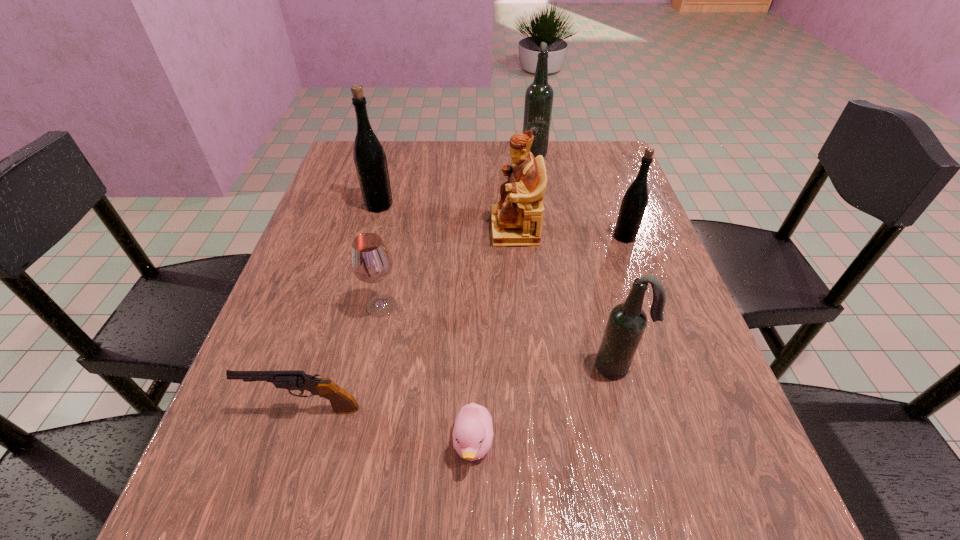
You are a GUI agent. You are given a task and a screenshot of the screen. Output one action in this format:
    pyautogui.click(x=<x>, y=<y>)
    Task: Click on the free spot that satisfies the following two spatial constraints: 1. on the front side of the bigger green beer bottle; 2. on the left side of the fifth farthest object
    This screenshot has width=960, height=540.
    Given the screenshot: What is the action you would take?
    pyautogui.click(x=351, y=306)